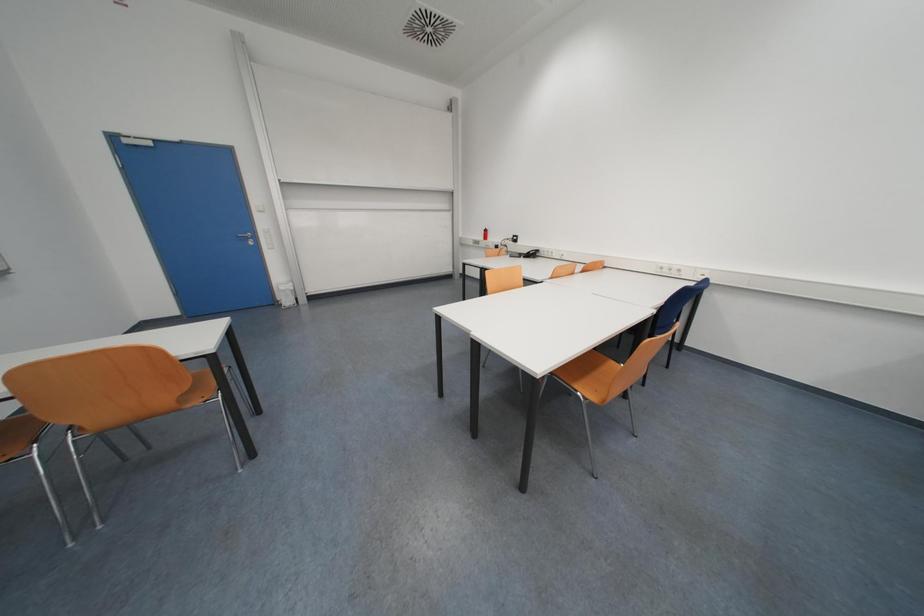
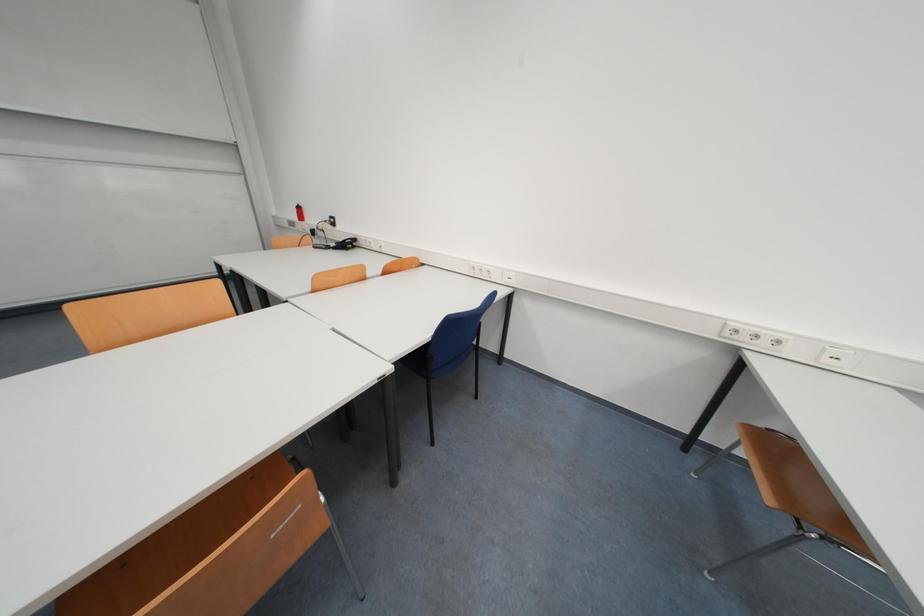
In a continuous first-person perspective shot, in which direction is the camera moving?

The cameraman walked toward right, forward.